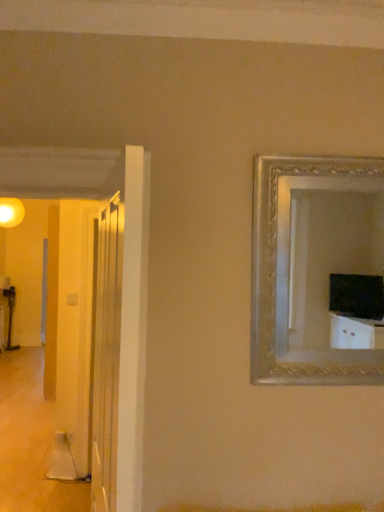
Identify the location of silver/golden metallic picture frame at upper right. The width and height of the screenshot is (384, 512). (317, 271).

The height and width of the screenshot is (512, 384). Describe the element at coordinates (317, 271) in the screenshot. I see `silver/golden metallic picture frame at upper right` at that location.

The width and height of the screenshot is (384, 512). Identify the location of silver/golden metallic picture frame at upper right. (317, 271).